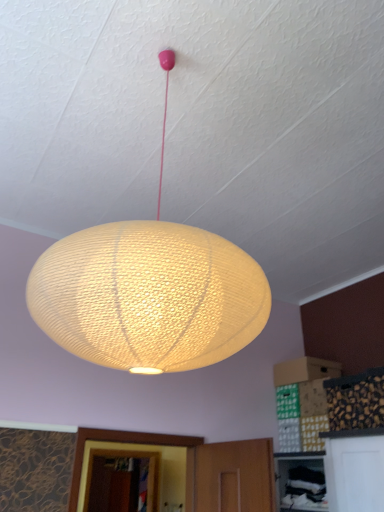
Image resolution: width=384 pixels, height=512 pixels. In order to click on matte white sphere at center in this screenshot , I will do `click(149, 292)`.

What do you see at coordinates (149, 292) in the screenshot?
I see `matte white sphere at center` at bounding box center [149, 292].

Locate an element on the screen. This screenshot has width=384, height=512. matte yellow woven lantern at center is located at coordinates (148, 296).

The image size is (384, 512). What do you see at coordinates (148, 296) in the screenshot?
I see `matte yellow woven lantern at center` at bounding box center [148, 296].

Identify the location of matte white sphere at center. (149, 292).

Does matte yellow woven lantern at center appear on the right side of matte white sphere at center?

Answer: In fact, matte yellow woven lantern at center is to the left of matte white sphere at center.

Is matte yellow woven lantern at center closer to camera compared to matte white sphere at center?

No.

Does point (228, 302) come in front of point (167, 298)?

No.

In the scene shown: From the image's perspective, which one is positioned lower, matte yellow woven lantern at center or matte white sphere at center?

From the image's view, matte yellow woven lantern at center is below.

From a real-world perspective, which is physically above, matte yellow woven lantern at center or matte white sphere at center?

matte yellow woven lantern at center, from a real-world perspective.

Is matte yellow woven lantern at center wider or thinner than matte white sphere at center?

matte yellow woven lantern at center is thinner than matte white sphere at center.

Is matte yellow woven lantern at center taller or shorter than matte white sphere at center?

In the image, matte yellow woven lantern at center appears to be shorter than matte white sphere at center.

Looking at the image, does matte yellow woven lantern at center seem bigger or smaller compared to matte white sphere at center?

Clearly, matte yellow woven lantern at center is smaller in size than matte white sphere at center.

Is matte yellow woven lantern at center inside or outside of matte white sphere at center?

matte yellow woven lantern at center is outside matte white sphere at center.

Is matte yellow woven lantern at center touching matte white sphere at center?

Yes, matte yellow woven lantern at center is beside matte white sphere at center.

From the picture: Is matte yellow woven lantern at center oriented away from matte white sphere at center?

No, matte yellow woven lantern at center is not facing the opposite direction of matte white sphere at center.

Find the location of a particular element. The width and height of the screenshot is (384, 512). lamp on the right of matte yellow woven lantern at center is located at coordinates (149, 292).

Does matte white sphere at center appear on the left side of matte yellow woven lantern at center?

No, matte white sphere at center is not to the left of matte yellow woven lantern at center.

Considering the relative positions of matte white sphere at center and matte yellow woven lantern at center in the image provided, is matte white sphere at center in front of matte yellow woven lantern at center?

Yes, matte white sphere at center is closer to the camera.

Considering the points (132, 342) and (179, 345), which point is behind, point (132, 342) or point (179, 345)?

The point (179, 345) is farther.

From the image's perspective, would you say matte white sphere at center is shown under matte yellow woven lantern at center?

Actually, matte white sphere at center appears above matte yellow woven lantern at center in the image.

Based on the photo, from a real-world perspective, between matte white sphere at center and matte yellow woven lantern at center, who is vertically lower?

matte white sphere at center, from a real-world perspective.

Can you confirm if matte white sphere at center is thinner than matte yellow woven lantern at center?

No.

Does matte white sphere at center have a greater height compared to matte yellow woven lantern at center?

Indeed, matte white sphere at center has a greater height compared to matte yellow woven lantern at center.

Based on their sizes in the image, would you say matte white sphere at center is bigger or smaller than matte yellow woven lantern at center?

Clearly, matte white sphere at center is larger in size than matte yellow woven lantern at center.

Is matte white sphere at center completely or partially outside of matte yellow woven lantern at center?

Yes, matte white sphere at center is not within matte yellow woven lantern at center.

Is matte white sphere at center far from matte yellow woven lantern at center?

No, matte white sphere at center is not far away from matte yellow woven lantern at center.

Is matte white sphere at center positioned with its back to matte yellow woven lantern at center?

No, matte white sphere at center's orientation is not away from matte yellow woven lantern at center.

Consider the image. How many degrees apart are the facing directions of matte white sphere at center and matte yellow woven lantern at center?

There is a 180-degree angle between the facing directions of matte white sphere at center and matte yellow woven lantern at center.

What are the coordinates of `lantern behind the matte white sphere at center` in the screenshot? It's located at (148, 296).

You are a GUI agent. You are given a task and a screenshot of the screen. Output one action in this format:
    pyautogui.click(x=<x>, y=<y>)
    Task: Click on the lamp located on the right of matte yellow woven lantern at center
    The image size is (384, 512).
    Given the screenshot: What is the action you would take?
    pyautogui.click(x=149, y=292)

Identify the location of lantern behind the matte white sphere at center. The width and height of the screenshot is (384, 512). (148, 296).